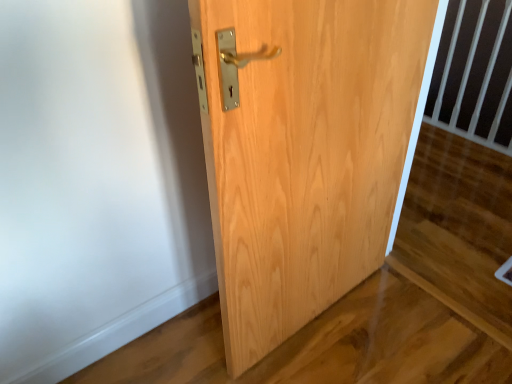
Locate an element on the screen. Image resolution: width=512 pixels, height=384 pixels. spots to the right of natural wood door at center is located at coordinates (395, 322).